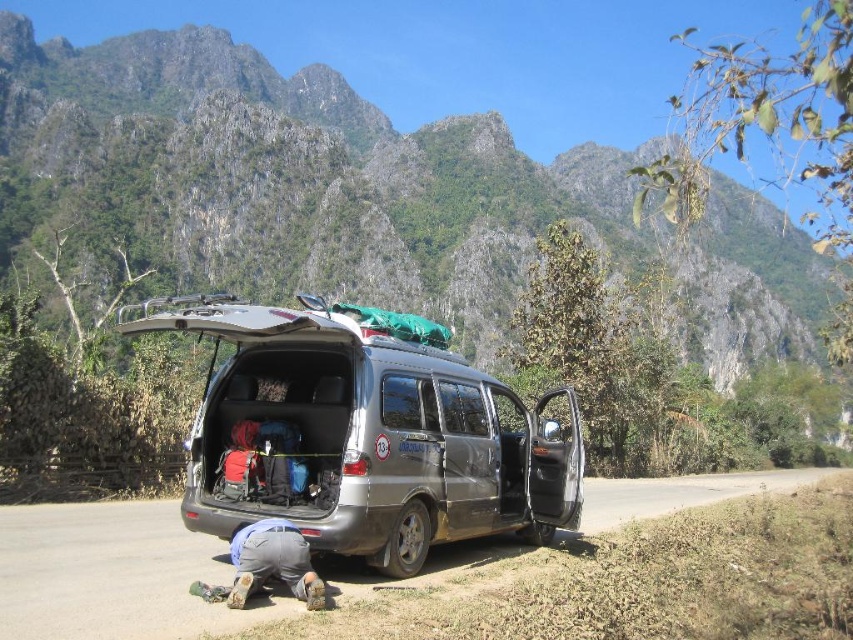
Is silver metallic van at center behind gray asphalt road at lower center?

Yes, silver metallic van at center is behind gray asphalt road at lower center.

Between silver metallic van at center and gray asphalt road at lower center, which one appears on the right side from the viewer's perspective?

gray asphalt road at lower center is more to the right.

Does point (416, 442) come in front of point (21, 561)?

No, (416, 442) is behind (21, 561).

Image resolution: width=853 pixels, height=640 pixels. In order to click on silver metallic van at center in this screenshot , I will do (364, 436).

Consider the image. Who is shorter, silver metallic van at center or gray fabric squat at lower center?

Standing shorter between the two is gray fabric squat at lower center.

Does point (212, 323) come farther from viewer compared to point (247, 588)?

Yes, point (212, 323) is behind point (247, 588).

Where is `silver metallic van at center`? silver metallic van at center is located at coordinates (364, 436).

Is gray asphalt road at lower center thinner than gray fabric squat at lower center?

Incorrect, gray asphalt road at lower center's width is not less than gray fabric squat at lower center's.

Based on the photo, between gray asphalt road at lower center and gray fabric squat at lower center, which one is positioned lower?

gray asphalt road at lower center is below.

Locate an element on the screen. This screenshot has width=853, height=640. gray asphalt road at lower center is located at coordinates (108, 573).